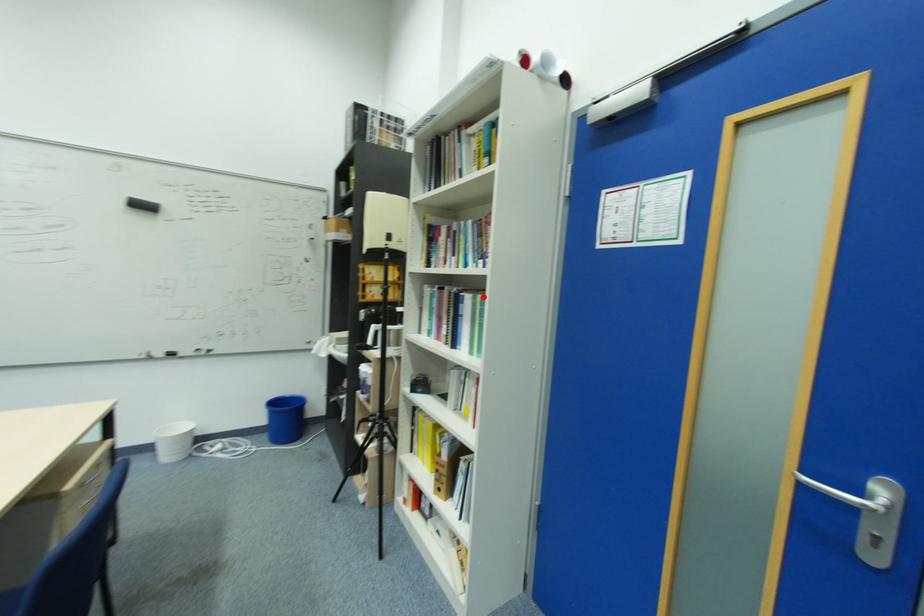
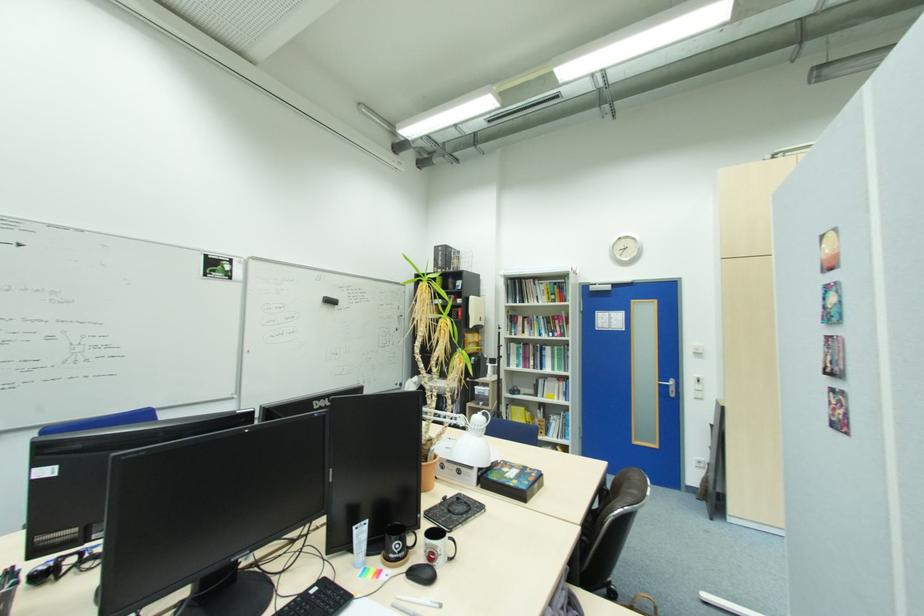
The point at the highlighted location is marked in the first image. Where is the corresponding point in the second image?

(560, 347)